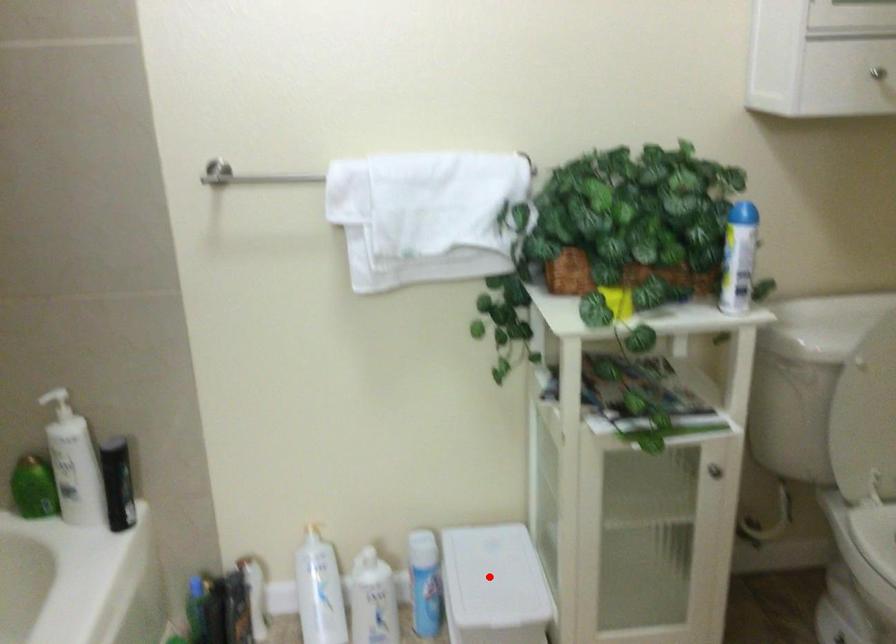
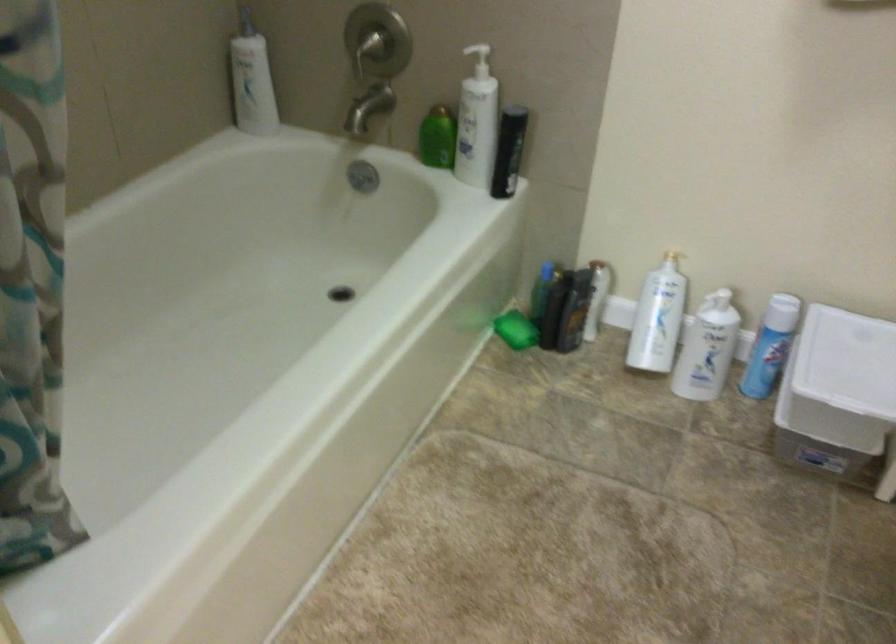
Question: I am providing you with two images of the same scene from different viewpoints. Given a red point in image1, look at the same physical point in image2. Is it:

Choices:
 (A) Closer to the viewpoint
 (B) Farther from the viewpoint

Answer: (A)